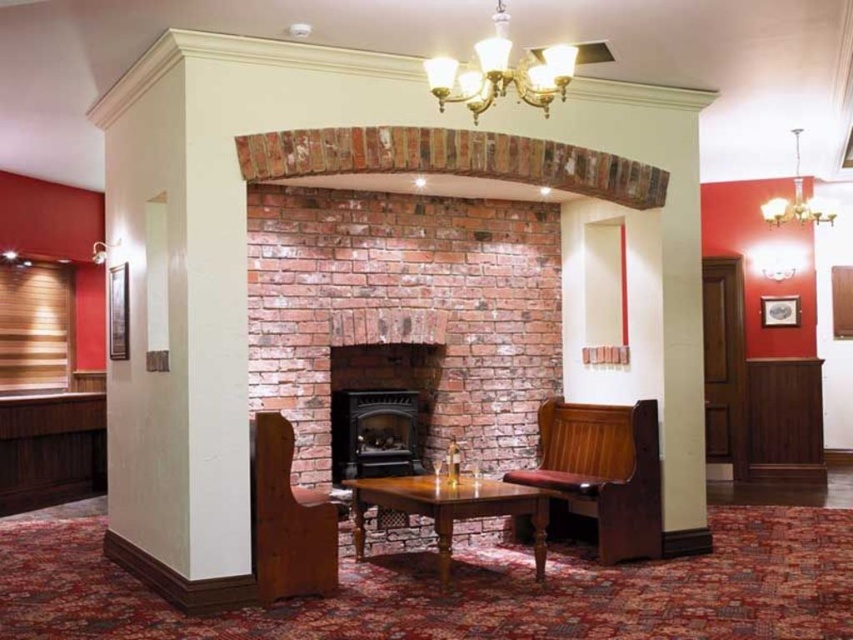
Is gold metallic chandelier at upper center smaller than gold metallic chandelier at upper right?

Yes.

At what (x,y) coordinates should I click in order to perform the action: click on gold metallic chandelier at upper center. Please return your answer as a coordinate pair (x, y). Looking at the image, I should click on (502, 72).

Which is in front, point (502, 44) or point (810, 214)?

Point (502, 44) is more forward.

You are a GUI agent. You are given a task and a screenshot of the screen. Output one action in this format:
    pyautogui.click(x=<x>, y=<y>)
    Task: Click on the gold metallic chandelier at upper center
    Image resolution: width=853 pixels, height=640 pixels.
    Given the screenshot: What is the action you would take?
    pyautogui.click(x=502, y=72)

Does brown wood armchair at lower left have a greater width compared to gold metallic chandelier at upper right?

No.

Does brown wood armchair at lower left appear on the left side of gold metallic chandelier at upper right?

Yes, brown wood armchair at lower left is to the left of gold metallic chandelier at upper right.

Describe the element at coordinates (288, 518) in the screenshot. I see `brown wood armchair at lower left` at that location.

At what (x,y) coordinates should I click in order to perform the action: click on brown wood armchair at lower left. Please return your answer as a coordinate pair (x, y). This screenshot has width=853, height=640. Looking at the image, I should click on (288, 518).

Is wooden table at center below gold metallic chandelier at upper right?

Yes.

Who is positioned more to the left, wooden table at center or gold metallic chandelier at upper right?

wooden table at center

Who is more forward, (444, 497) or (827, 212)?

Point (444, 497)

Where is `wooden table at center`? wooden table at center is located at coordinates (450, 508).